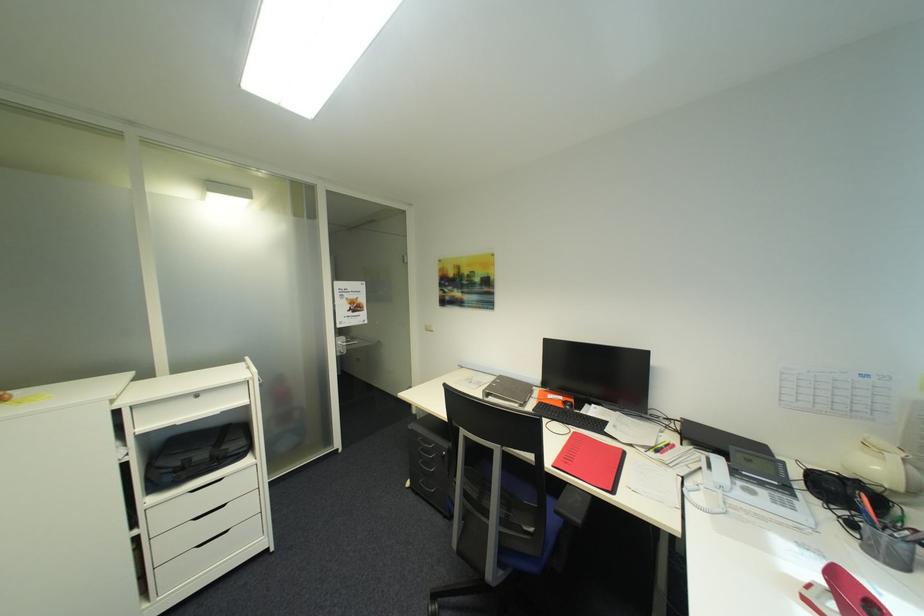
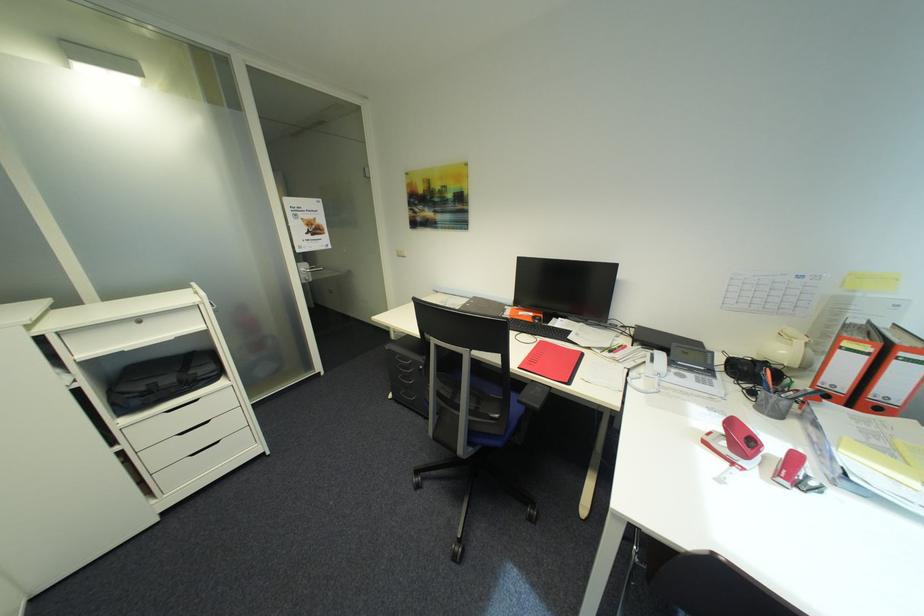
Find the pixel in the second image that matches (x=832, y=562) in the first image.

(733, 419)